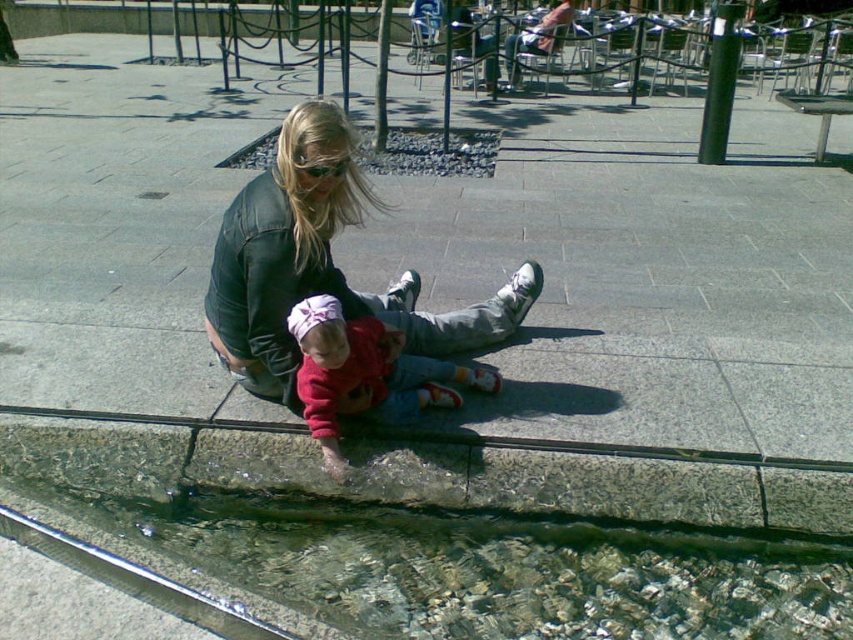
Question: Which object is positioned farthest from the clear glass curb at lower center?

Choices:
 (A) matte black goggles at center
 (B) leather jacket at center
 (C) red fleece sweater at center

Answer: (A)

Question: Can you confirm if clear glass curb at lower center is positioned below matte black goggles at center?

Choices:
 (A) yes
 (B) no

Answer: (A)

Question: From the image, what is the correct spatial relationship of clear glass curb at lower center in relation to leather jacket at center?

Choices:
 (A) above
 (B) below

Answer: (B)

Question: Which is nearer to the red fleece sweater at center?

Choices:
 (A) leather jacket at center
 (B) clear glass curb at lower center
 (C) matte black goggles at center

Answer: (A)

Question: Is clear glass curb at lower center smaller than matte black goggles at center?

Choices:
 (A) no
 (B) yes

Answer: (A)

Question: Which of the following is the farthest from the observer?

Choices:
 (A) (418, 397)
 (B) (334, 168)

Answer: (A)